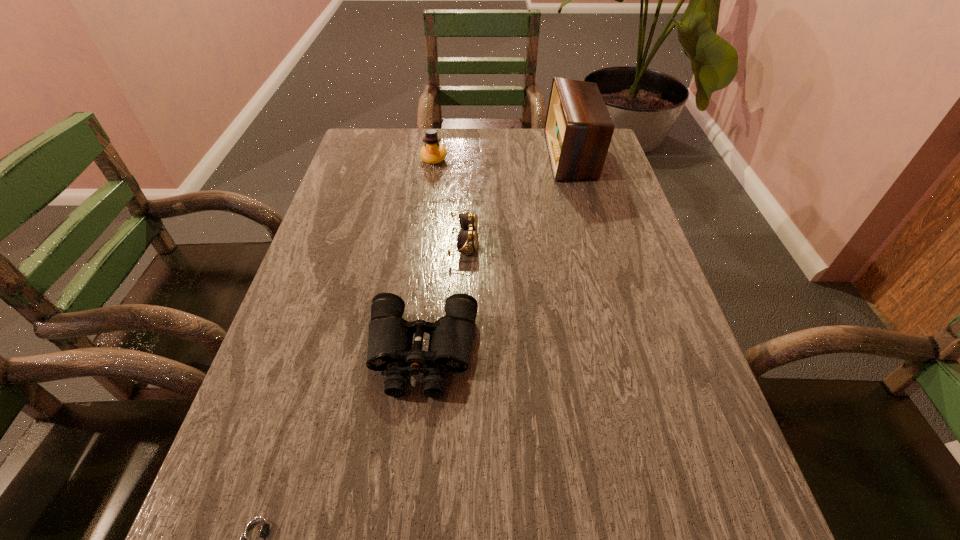
Find the location of a particular element. The width and height of the screenshot is (960, 540). free space in the image that satisfies the following two spatial constraints: 1. on the front-facing side of the tallest object; 2. through the eyepieces of the binoculars is located at coordinates (625, 353).